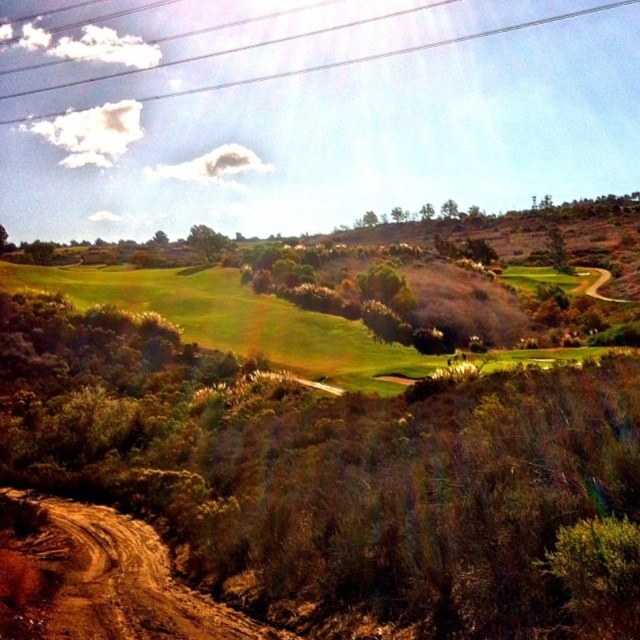
Does brown dirt track at lower left have a lesser width compared to metallic wires at upper center?

Yes, brown dirt track at lower left is thinner than metallic wires at upper center.

How distant is brown dirt track at lower left from metallic wires at upper center?

The distance of brown dirt track at lower left from metallic wires at upper center is 283.66 meters.

The height and width of the screenshot is (640, 640). In order to click on brown dirt track at lower left in this screenshot , I will do `click(99, 579)`.

Where is `brown dirt track at lower left`? The image size is (640, 640). brown dirt track at lower left is located at coordinates (99, 579).